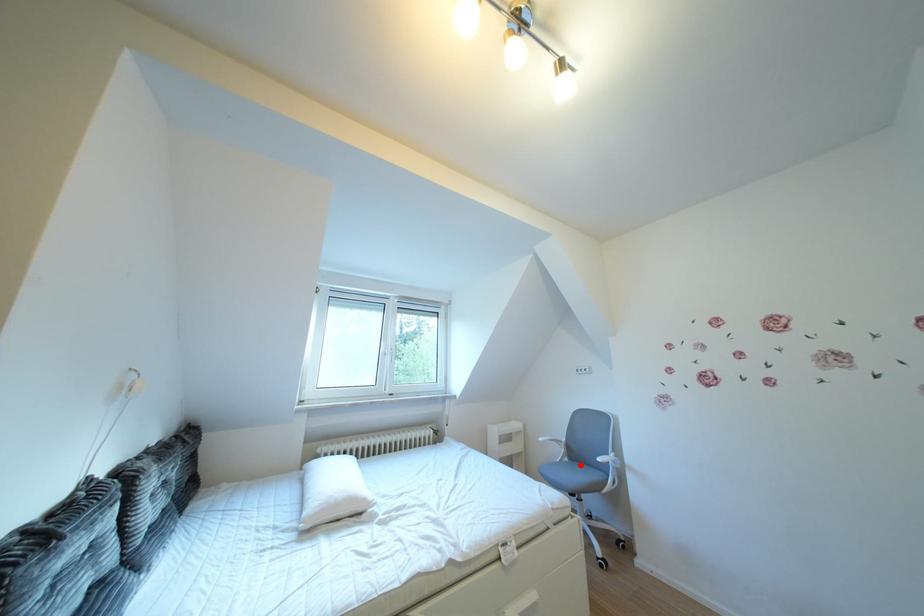
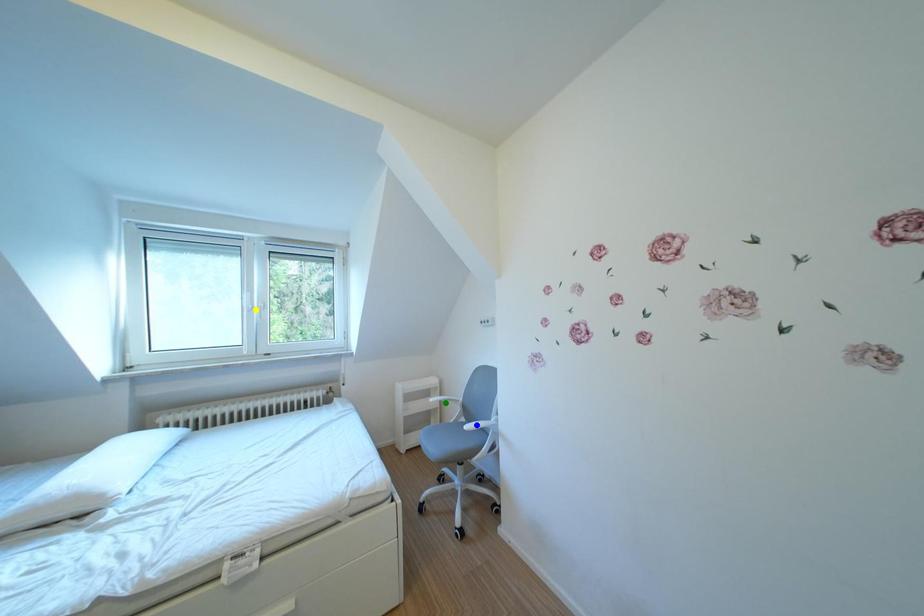
Question: I am providing you with two images of the same scene from different viewpoints. A red point is marked on the first image. You are given multiple points on the second image. Which point in image 2 represents the same 3d spot as the red point in image 1?

Choices:
 (A) blue point
 (B) yellow point
 (C) green point

Answer: (A)